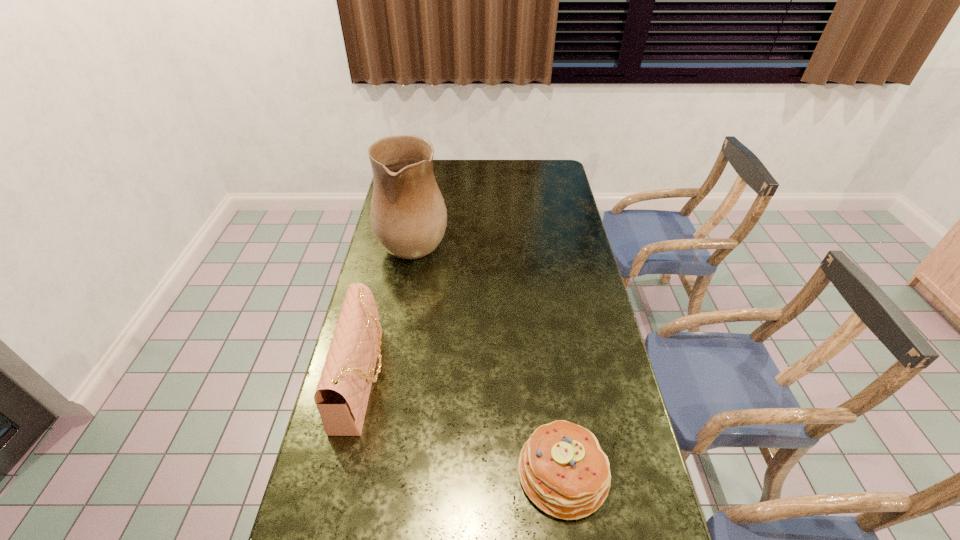
Locate an element on the screen. The width and height of the screenshot is (960, 540). free space that satisfies the following two spatial constraints: 1. at the spout of the pancake; 2. on the right side of the cream pitcher is located at coordinates (373, 472).

Identify the location of free space in the image that satisfies the following two spatial constraints: 1. on the back side of the shortest object; 2. on the front-facing side of the second tallest object. The height and width of the screenshot is (540, 960). (550, 379).

At what (x,y) coordinates should I click in order to perform the action: click on free space that satisfies the following two spatial constraints: 1. on the front-facing side of the second shortest object; 2. on the right side of the shortest object. Please return your answer as a coordinate pair (x, y). The height and width of the screenshot is (540, 960). Looking at the image, I should click on (342, 472).

The image size is (960, 540). Identify the location of vacant area that satisfies the following two spatial constraints: 1. at the spout of the farthest object; 2. on the back side of the rightmost object. (373, 472).

Find the location of a particular element. This screenshot has height=540, width=960. free spot that satisfies the following two spatial constraints: 1. on the front-facing side of the handbag; 2. on the left side of the rightmost object is located at coordinates (342, 472).